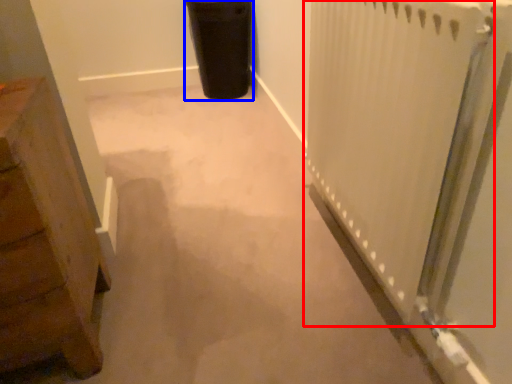
Question: Which of the following is the farthest to the observer, radiator (highlighted by a red box) or garbage (highlighted by a blue box)?

Choices:
 (A) radiator
 (B) garbage

Answer: (B)